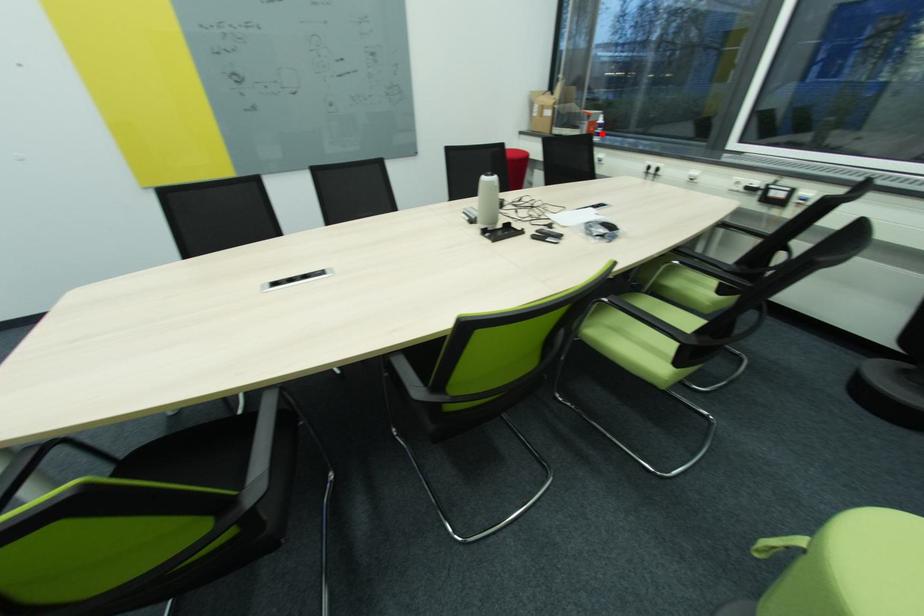
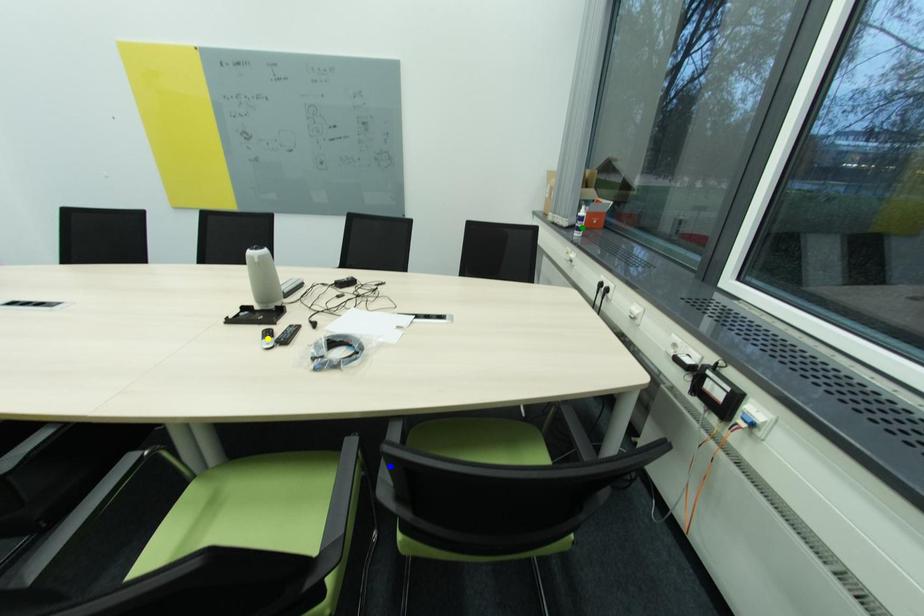
Question: I am providing you with two images of the same scene from different viewpoints. A red point is marked on the first image. You are given multiple points on the second image. In image 2, which mark is for the same physical point as the one in image 1?

Choices:
 (A) green point
 (B) yellow point
 (C) blue point

Answer: (A)